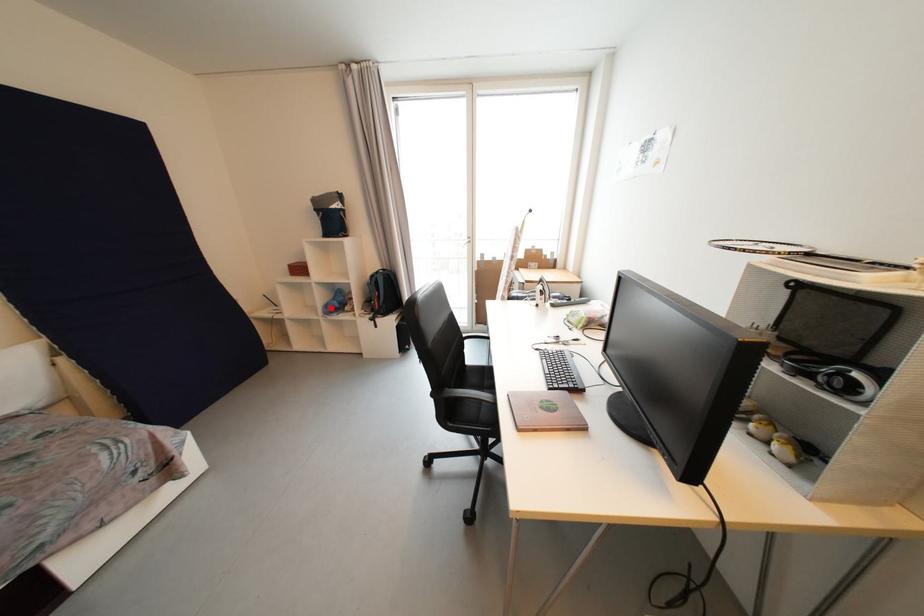
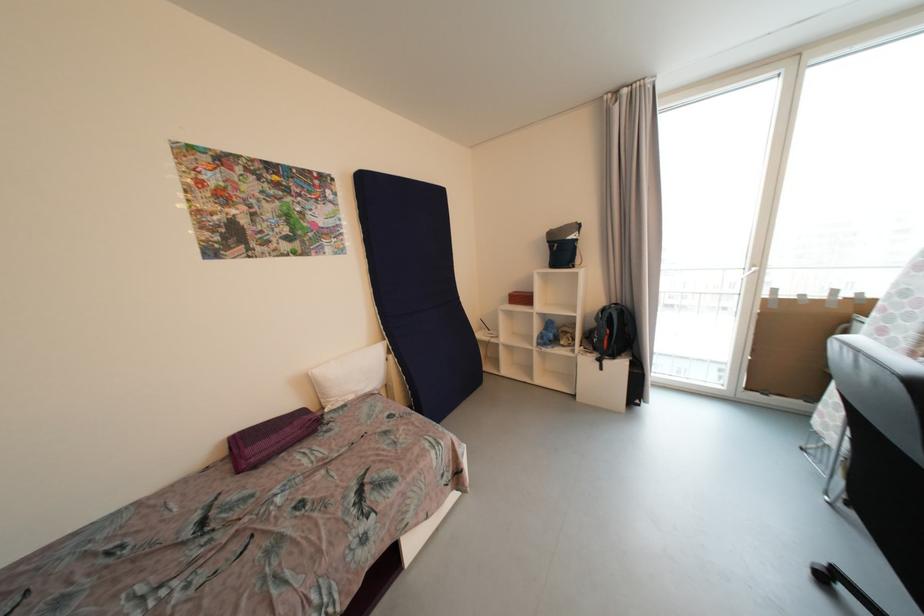
Question: I am providing you with two images of the same scene from different viewpoints. In image1, a red point is highlighted. Considering the same 3D point in image2, which of the following is correct?

Choices:
 (A) It is closer
 (B) It is farther

Answer: (B)